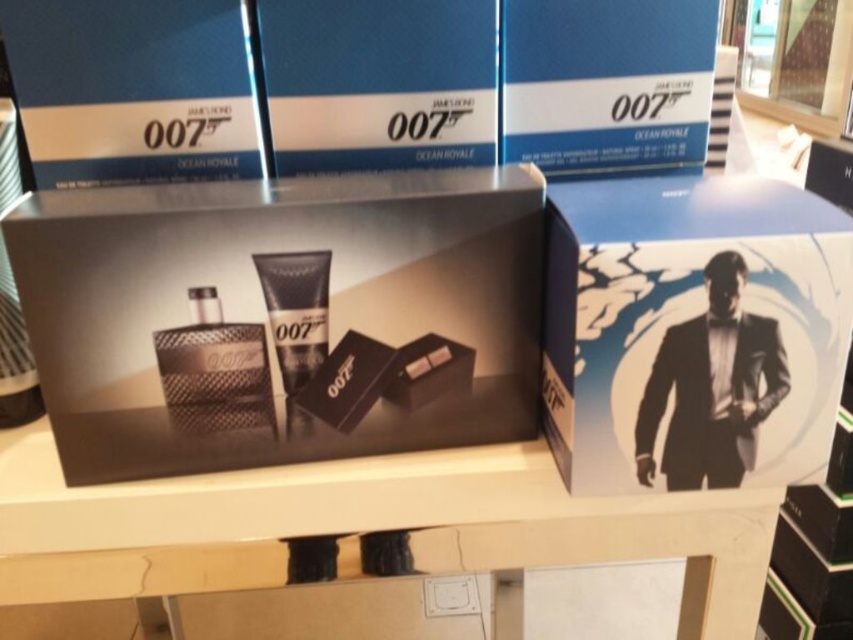
Between blue cardboard box at upper left and blue cardboard box at center, which one has more height?

blue cardboard box at upper left

This screenshot has width=853, height=640. What are the coordinates of `blue cardboard box at upper left` in the screenshot? It's located at (132, 90).

Does matte black box at center have a lesser width compared to white glossy table at center?

Yes, matte black box at center is thinner than white glossy table at center.

Is matte black box at center wider than white glossy table at center?

No, matte black box at center is not wider than white glossy table at center.

At what (x,y) coordinates should I click in order to perform the action: click on matte black box at center. Please return your answer as a coordinate pair (x, y). Looking at the image, I should click on (282, 316).

The height and width of the screenshot is (640, 853). I want to click on matte black box at center, so click(282, 316).

Does white glossy table at center have a larger size compared to blue cardboard box at upper center?

Yes.

Can you confirm if white glossy table at center is taller than blue cardboard box at upper center?

Yes.

Locate an element on the screen. white glossy table at center is located at coordinates (366, 525).